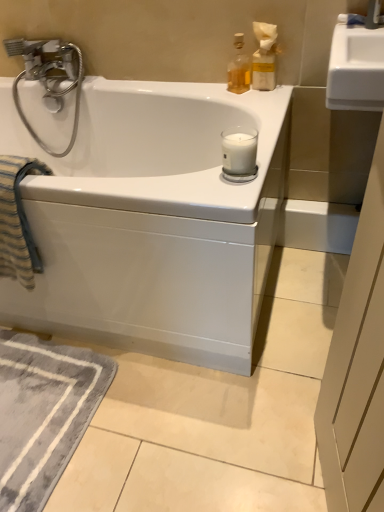
In order to click on vacant space situated on the left part of translucent glass bottle at upper right, acting as the first bottle starting from the left in this screenshot , I will do `click(205, 89)`.